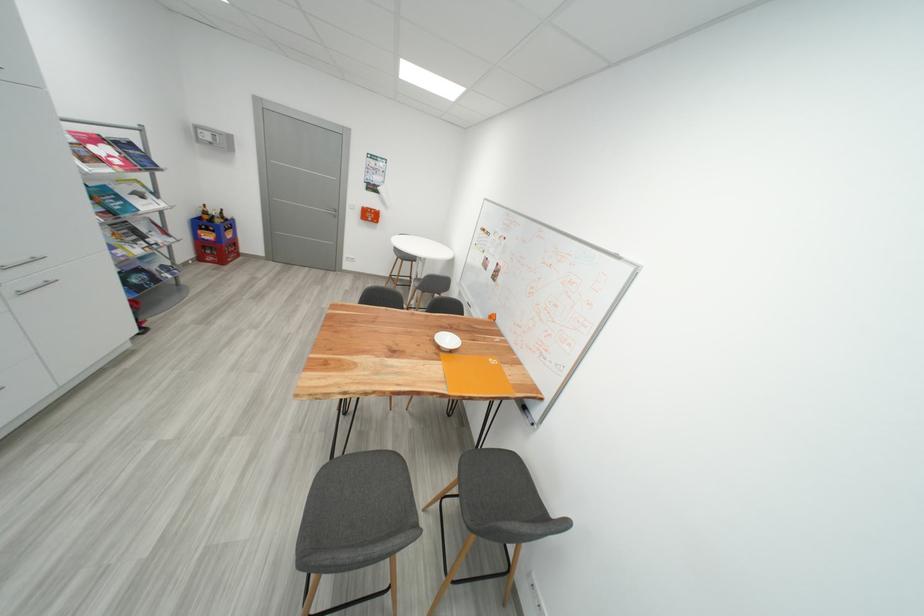
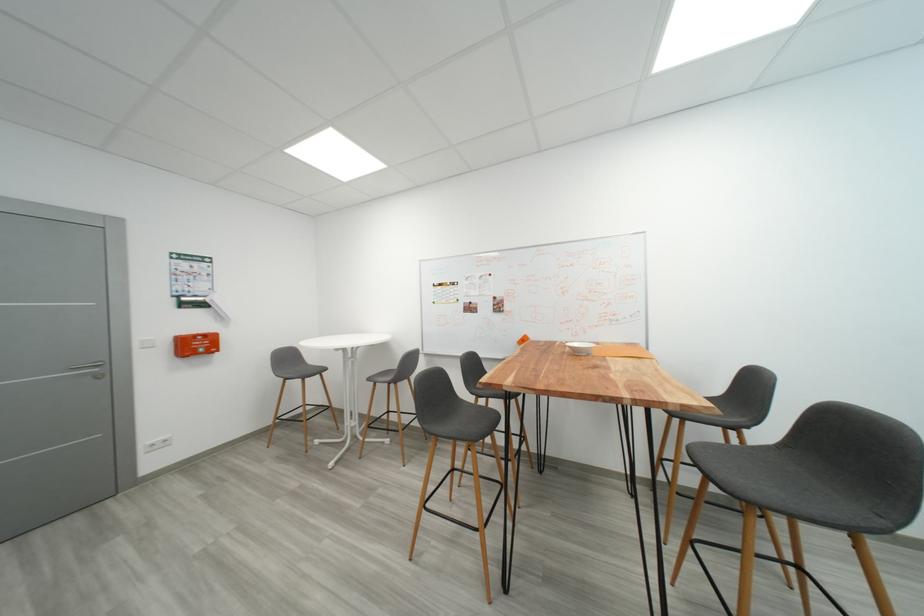
Where in the second image is the point corresponding to (x=378, y=217) from the first image?

(203, 347)